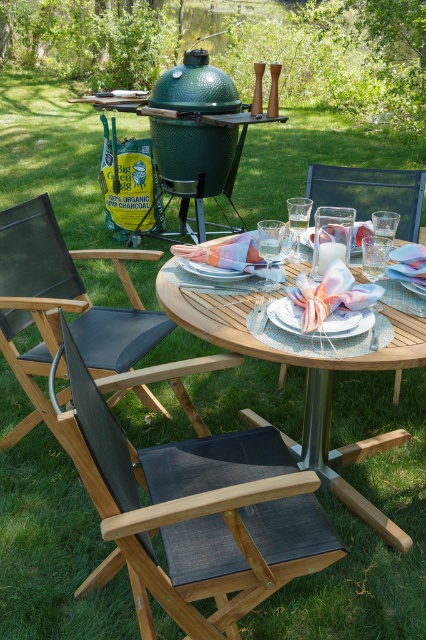
You are standing at the center of the round wooden table and want to sit down on the black fabric chair at lower left. In which direction should you walk to reach it?

You should walk towards the lower left direction to reach the black fabric chair at lower left.

You are a guest arriving at the outdoor dining area and need to sit down. Which object is taller between the black fabric chair at lower left and the pastel fabric napkin at center?

The black fabric chair at lower left is taller than the pastel fabric napkin at center.